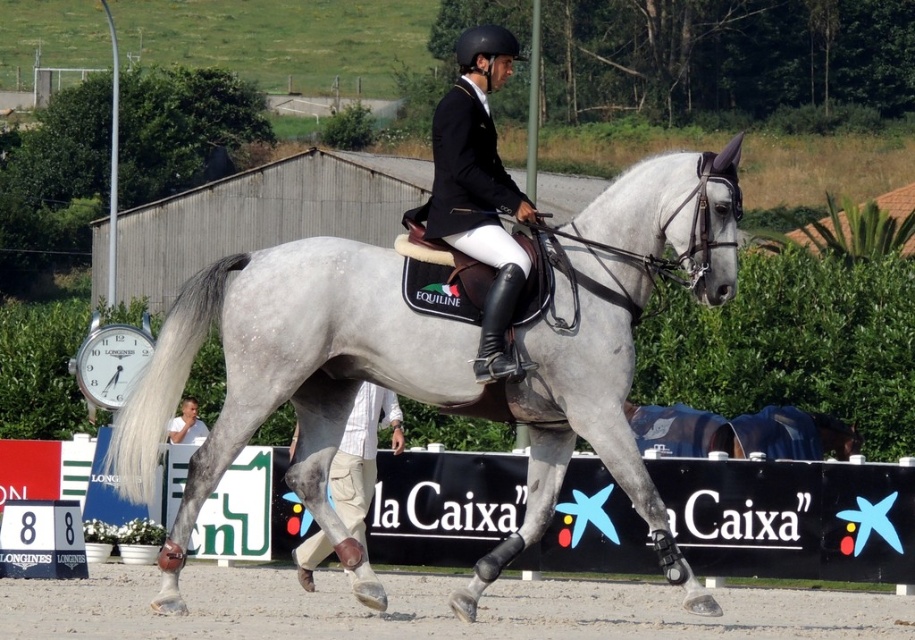
Which is above, gray matte/suede horse at center or black leather jacket at center?

black leather jacket at center

Is gray matte/suede horse at center smaller than black leather jacket at center?

Actually, gray matte/suede horse at center might be larger than black leather jacket at center.

Find the location of a particular element. gray matte/suede horse at center is located at coordinates 436,355.

Between gray sand at center and black leather jacket at center, which one is positioned lower?

gray sand at center

Does gray sand at center appear on the right side of black leather jacket at center?

No, gray sand at center is not to the right of black leather jacket at center.

Locate an element on the screen. The height and width of the screenshot is (640, 915). gray sand at center is located at coordinates (428, 609).

Where is `gray sand at center`? The image size is (915, 640). gray sand at center is located at coordinates (428, 609).

Does gray matte/suede horse at center have a smaller size compared to gray sand at center?

No.

Who is more forward, (297, 448) or (510, 632)?

Point (510, 632) is more forward.

You are a GUI agent. You are given a task and a screenshot of the screen. Output one action in this format:
    pyautogui.click(x=<x>, y=<y>)
    Task: Click on the gray matte/suede horse at center
    
    Given the screenshot: What is the action you would take?
    pyautogui.click(x=436, y=355)